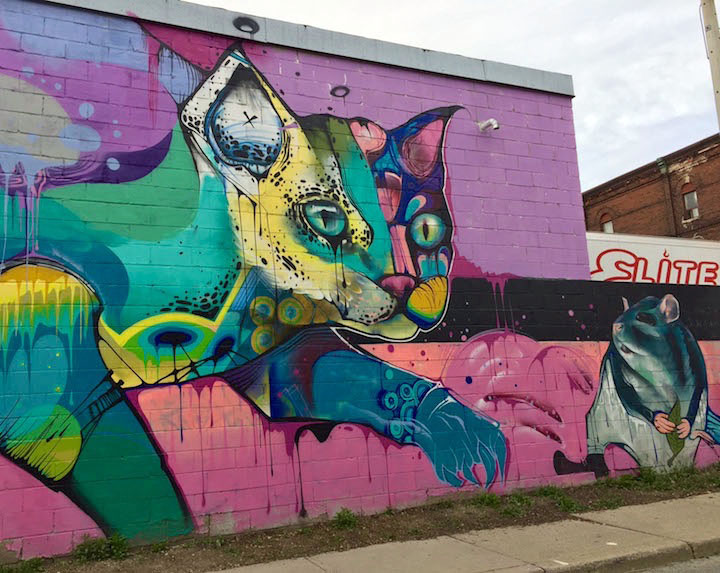
Where is `mural`? Image resolution: width=720 pixels, height=573 pixels. mural is located at coordinates (474, 288).